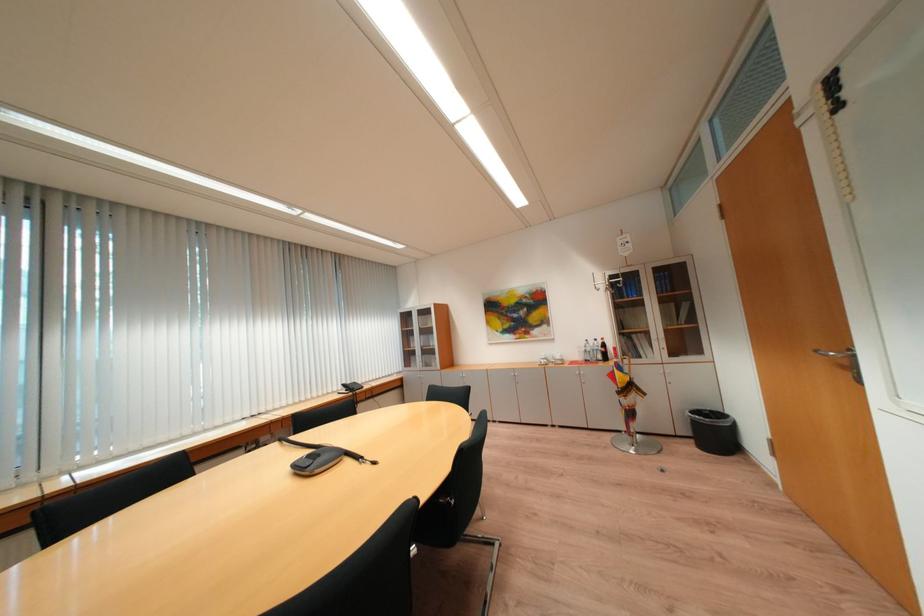
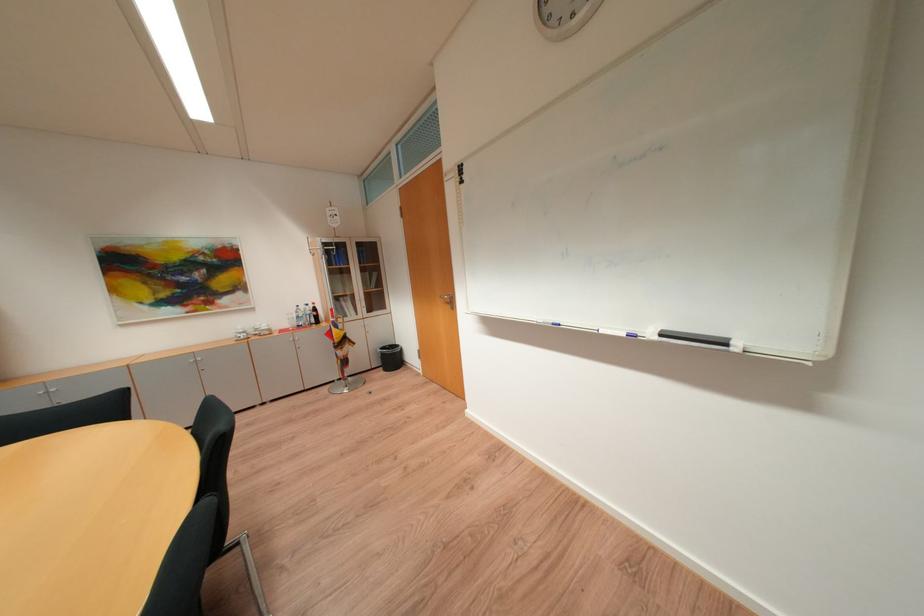
Question: The images are taken continuously from a first-person perspective. In which direction is your viewpoint rotating?

Choices:
 (A) Left
 (B) Right
 (C) Up
 (D) Down

Answer: (B)